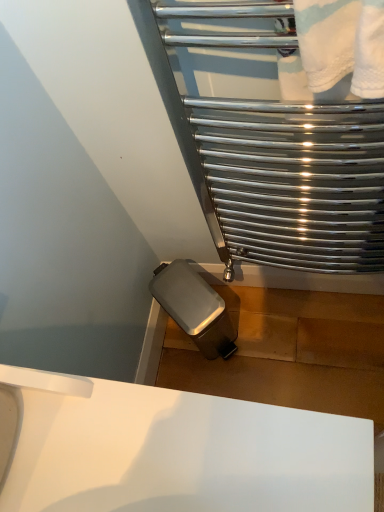
Question: Does polished chrome towel rack at upper right have a smaller size compared to white glossy sink at lower center?

Choices:
 (A) yes
 (B) no

Answer: (A)

Question: Considering the relative sizes of polished chrome towel rack at upper right and white glossy sink at lower center in the image provided, is polished chrome towel rack at upper right wider than white glossy sink at lower center?

Choices:
 (A) no
 (B) yes

Answer: (A)

Question: Is polished chrome towel rack at upper right positioned in front of white glossy sink at lower center?

Choices:
 (A) no
 (B) yes

Answer: (A)

Question: From the image's perspective, is polished chrome towel rack at upper right on top of white glossy sink at lower center?

Choices:
 (A) no
 (B) yes

Answer: (B)

Question: Considering the relative sizes of polished chrome towel rack at upper right and white glossy sink at lower center in the image provided, is polished chrome towel rack at upper right shorter than white glossy sink at lower center?

Choices:
 (A) no
 (B) yes

Answer: (A)

Question: Can you confirm if polished chrome towel rack at upper right is bigger than white glossy sink at lower center?

Choices:
 (A) yes
 (B) no

Answer: (B)

Question: From a real-world perspective, is white glossy sink at lower center beneath polished chrome towel rack at upper right?

Choices:
 (A) yes
 (B) no

Answer: (B)

Question: Is white glossy sink at lower center oriented towards polished chrome towel rack at upper right?

Choices:
 (A) no
 (B) yes

Answer: (A)

Question: Is polished chrome towel rack at upper right at the back of white glossy sink at lower center?

Choices:
 (A) no
 (B) yes

Answer: (A)

Question: Does white glossy sink at lower center contain polished chrome towel rack at upper right?

Choices:
 (A) no
 (B) yes

Answer: (A)

Question: Is white glossy sink at lower center taller than polished chrome towel rack at upper right?

Choices:
 (A) yes
 (B) no

Answer: (B)

Question: Is white glossy sink at lower center completely or partially outside of polished chrome towel rack at upper right?

Choices:
 (A) yes
 (B) no

Answer: (A)

Question: Considering the positions of white glossy sink at lower center and polished chrome towel rack at upper right in the image, is white glossy sink at lower center taller or shorter than polished chrome towel rack at upper right?

Choices:
 (A) tall
 (B) short

Answer: (B)